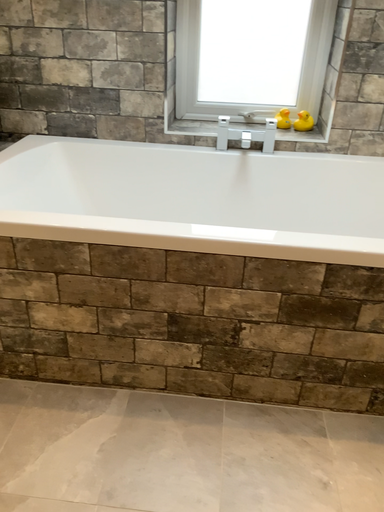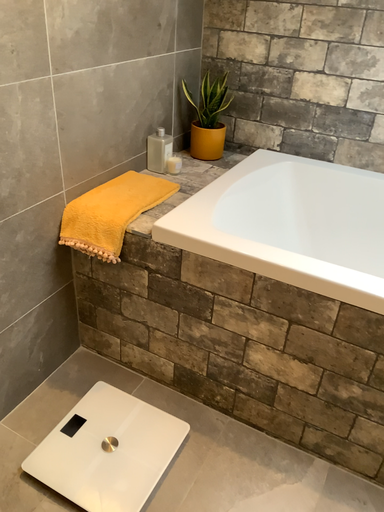
Question: How did the camera likely rotate when shooting the video?

Choices:
 (A) rotated left
 (B) rotated right

Answer: (A)